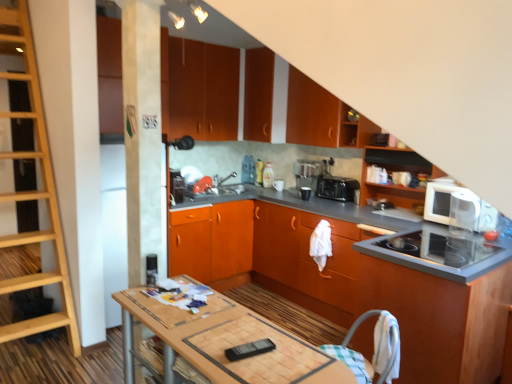
At what (x,y) coordinates should I click in order to perform the action: click on vacant area on top of wooden table at center (from a real-world perspective). Please return your answer as a coordinate pair (x, y). Image resolution: width=512 pixels, height=384 pixels. Looking at the image, I should click on (221, 329).